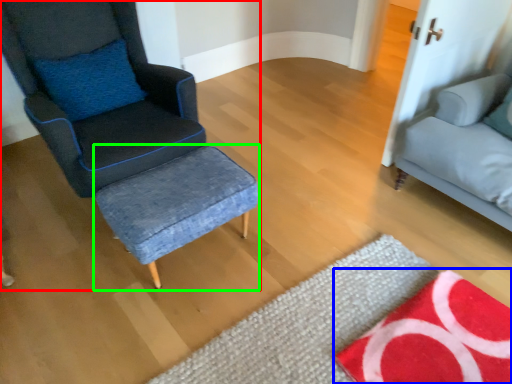
Question: Estimate the real-world distances between objects in this image. Which object is farther from chair (highlighted by a red box), mat (highlighted by a blue box) or stool (highlighted by a green box)?

Choices:
 (A) mat
 (B) stool

Answer: (A)